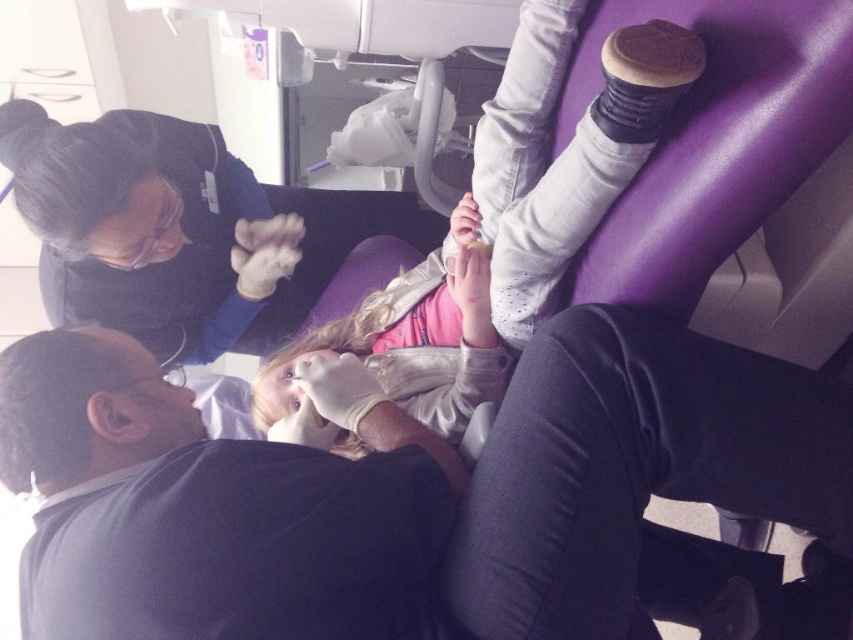
Question: Can you confirm if dark gray shirt at upper left is positioned above light pink fabric at center?

Choices:
 (A) no
 (B) yes

Answer: (A)

Question: Which object appears closest to the camera in this image?

Choices:
 (A) light pink fabric at center
 (B) dark gray shirt at upper left

Answer: (B)

Question: In this image, where is dark gray shirt at upper left located relative to light pink fabric at center?

Choices:
 (A) right
 (B) left

Answer: (B)

Question: Does dark gray shirt at upper left have a smaller size compared to light pink fabric at center?

Choices:
 (A) no
 (B) yes

Answer: (B)